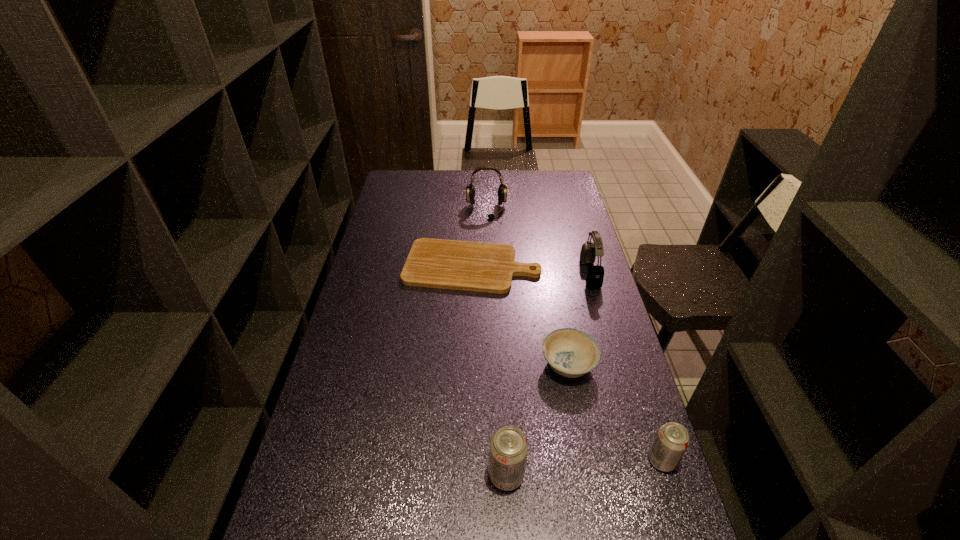
You are a GUI agent. You are given a task and a screenshot of the screen. Output one action in this format:
    pyautogui.click(x=<x>, y=<y>)
    Task: Click on the bowl that is positioned at the right edge
    The height and width of the screenshot is (540, 960).
    Given the screenshot: What is the action you would take?
    pyautogui.click(x=572, y=353)

Locate an element on the screen. This screenshot has height=540, width=960. vacant space at the far edge of the desktop is located at coordinates (519, 185).

Image resolution: width=960 pixels, height=540 pixels. In the image, there is a desktop. Identify the location of vacant space at the near edge. (529, 513).

In the image, there is a desktop. Identify the location of vacant region at the left edge. (363, 318).

Where is `vacant space at the right edge of the desktop`? vacant space at the right edge of the desktop is located at coordinates (563, 212).

Locate an element on the screen. The width and height of the screenshot is (960, 540). vacant space at the far left corner of the desktop is located at coordinates (404, 190).

Find the location of `free space at the far right corner of the desktop`. free space at the far right corner of the desktop is located at coordinates (x=552, y=170).

Find the location of a particular element. The image size is (960, 540). vacant region between the taller soda can and the right soda can is located at coordinates (584, 468).

This screenshot has height=540, width=960. I want to click on free space between the right headset and the left headset, so click(539, 241).

Where is `vacant space that's between the right soda can and the taller soda can`? vacant space that's between the right soda can and the taller soda can is located at coordinates (584, 468).